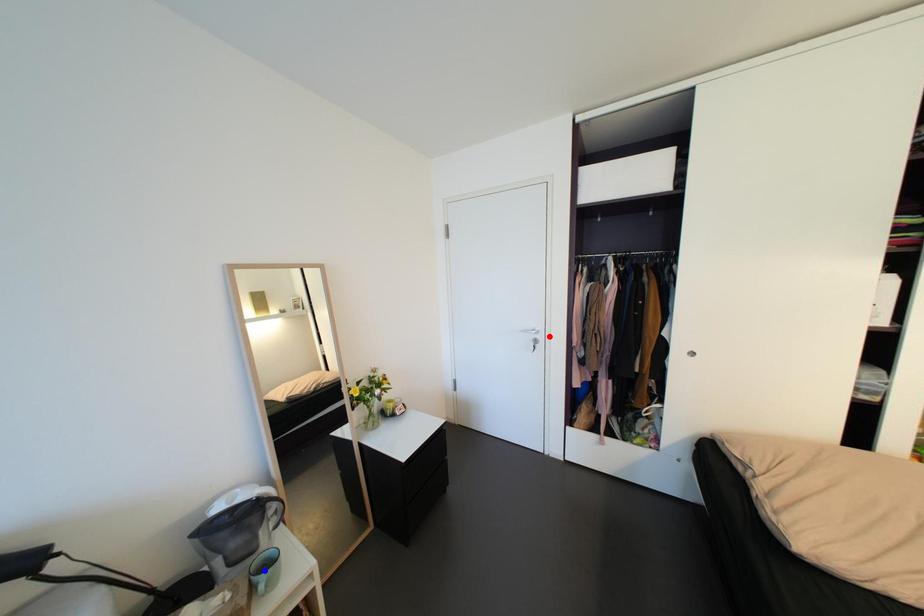
Question: In the image, two points are highlighted. Which point is nearer to the camera? Reply with the corresponding letter.

Choices:
 (A) blue point
 (B) red point

Answer: (A)